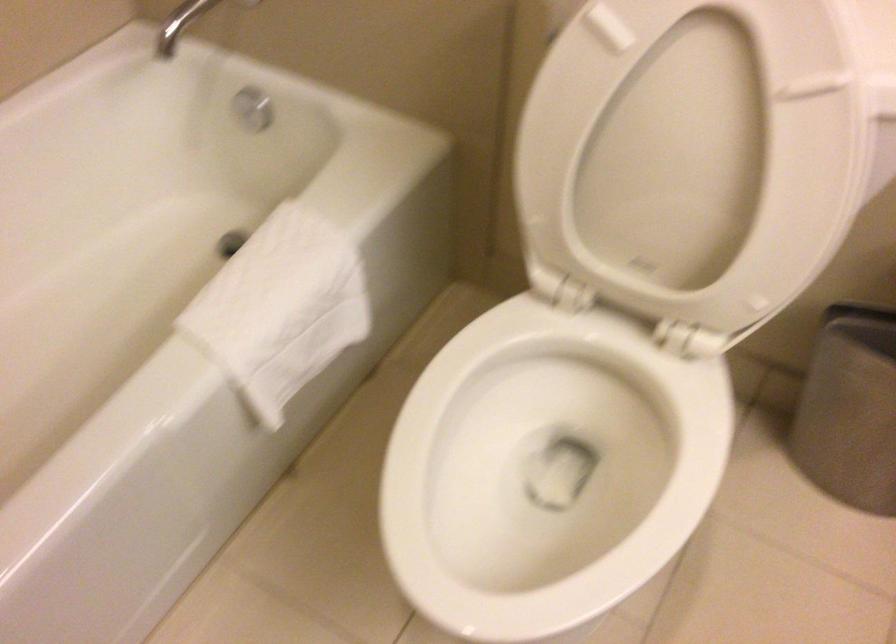
Find where to turn the silver water knob. Please return your answer as a coordinate pair (x, y).

(252, 108)